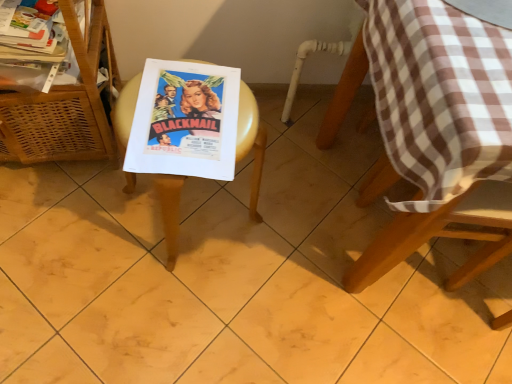
This screenshot has height=384, width=512. Describe the element at coordinates (185, 121) in the screenshot. I see `matte paper poster at center` at that location.

The width and height of the screenshot is (512, 384). I want to click on matte paper poster at center, so tap(185, 121).

This screenshot has width=512, height=384. What do you see at coordinates (29, 67) in the screenshot?
I see `white glossy magazine at upper left` at bounding box center [29, 67].

In order to face wooden picnic table at center, should I rotate leftwards or rightwards?

It's best to rotate left around 9.105 degrees.

Locate an element on the screen. The image size is (512, 384). matte paper poster at center is located at coordinates click(x=185, y=121).

How many degrees apart are the facing directions of woven wood basket at left and wooden picnic table at center?

woven wood basket at left and wooden picnic table at center are facing 33.6 degrees away from each other.

From the image's perspective, between woven wood basket at left and wooden picnic table at center, who is located below?

wooden picnic table at center is shown below in the image.

Measure the distance between woven wood basket at left and wooden picnic table at center.

woven wood basket at left is 7.87 inches from wooden picnic table at center.

Which of these two, woven wood basket at left or wooden picnic table at center, is bigger?

Bigger between the two is woven wood basket at left.

From a real-world perspective, who is located lower, white glossy magazine at upper left or woven wood basket at left?

woven wood basket at left.

This screenshot has height=384, width=512. I want to click on furniture below the white glossy magazine at upper left (from a real-world perspective), so [x=65, y=103].

Is white glossy magazine at upper left shorter than woven wood basket at left?

Correct, white glossy magazine at upper left is not as tall as woven wood basket at left.

What's the angular difference between white glossy magazine at upper left and wooden picnic table at center's facing directions?

The angle between the facing direction of white glossy magazine at upper left and the facing direction of wooden picnic table at center is 36.3 degrees.

Does white glossy magazine at upper left have a smaller size compared to wooden picnic table at center?

Correct, white glossy magazine at upper left occupies less space than wooden picnic table at center.

In the image, is white glossy magazine at upper left positioned in front of or behind wooden picnic table at center?

In the image, white glossy magazine at upper left appears behind wooden picnic table at center.

In the scene shown: Does white glossy magazine at upper left turn towards wooden picnic table at center?

No, white glossy magazine at upper left is not turned towards wooden picnic table at center.

In the scene shown: Can you tell me how much wooden picnic table at center and matte paper poster at center differ in facing direction?

40.4 degrees separate the facing orientations of wooden picnic table at center and matte paper poster at center.

Is wooden picnic table at center bigger than matte paper poster at center?

Yes.

Is matte paper poster at center completely or partially inside wooden picnic table at center?

Yes, matte paper poster at center is a part of wooden picnic table at center.

Is wooden picnic table at center aimed at matte paper poster at center?

No, wooden picnic table at center does not turn towards matte paper poster at center.

Based on the photo, from a real-world perspective, is woven wood basket at left physically above white glossy magazine at upper left?

Actually, woven wood basket at left is physically below white glossy magazine at upper left in the real world.

What's the angular difference between woven wood basket at left and white glossy magazine at upper left's facing directions?

woven wood basket at left and white glossy magazine at upper left are facing 2.67 degrees away from each other.

Is woven wood basket at left at the left side of white glossy magazine at upper left?

Correct, you'll find woven wood basket at left to the left of white glossy magazine at upper left.

The width and height of the screenshot is (512, 384). In order to click on magazine that is above the woven wood basket at left (from the image's perspective) in this screenshot , I will do `click(29, 67)`.

How different are the orientations of white glossy magazine at upper left and brown checkered tablecloth at upper right in degrees?

There is a 0.585-degree angle between the facing directions of white glossy magazine at upper left and brown checkered tablecloth at upper right.

Is white glossy magazine at upper left wider than brown checkered tablecloth at upper right?

No.

Is white glossy magazine at upper left far from brown checkered tablecloth at upper right?

Actually, white glossy magazine at upper left and brown checkered tablecloth at upper right are a little close together.

From the image's perspective, which is above, white glossy magazine at upper left or brown checkered tablecloth at upper right?

From the image's view, brown checkered tablecloth at upper right is above.

This screenshot has height=384, width=512. Identify the location of magazine behind the brown checkered tablecloth at upper right. (29, 67).

In terms of width, does brown checkered tablecloth at upper right look wider or thinner when compared to white glossy magazine at upper left?

In the image, brown checkered tablecloth at upper right appears to be wider than white glossy magazine at upper left.

Considering the relative positions of brown checkered tablecloth at upper right and white glossy magazine at upper left in the image provided, is brown checkered tablecloth at upper right behind white glossy magazine at upper left?

No, brown checkered tablecloth at upper right is closer to the viewer.

Is brown checkered tablecloth at upper right directly adjacent to white glossy magazine at upper left?

No.

You are a GUI agent. You are given a task and a screenshot of the screen. Output one action in this format:
    pyautogui.click(x=<x>, y=<y>)
    Task: Click on the picnic table on the right side of woven wood basket at left
    The height and width of the screenshot is (384, 512).
    Given the screenshot: What is the action you would take?
    pyautogui.click(x=251, y=143)

This screenshot has width=512, height=384. Find the location of `furniture in front of the white glossy magazine at upper left`. furniture in front of the white glossy magazine at upper left is located at coordinates 65,103.

From the image, which object appears to be farther from wooden picnic table at center, matte paper poster at center or white glossy magazine at upper left?

white glossy magazine at upper left lies further to wooden picnic table at center than the other object.

From the image, which object appears to be nearer to woven wood basket at left, matte paper poster at center or white glossy magazine at upper left?

Based on the image, white glossy magazine at upper left appears to be nearer to woven wood basket at left.

In the scene shown: Looking at the image, which one is located closer to brown checkered tablecloth at upper right, wooden picnic table at center or matte paper poster at center?

Among the two, matte paper poster at center is located nearer to brown checkered tablecloth at upper right.

Considering their positions, is wooden picnic table at center positioned further to woven wood basket at left than white glossy magazine at upper left?

The object further to woven wood basket at left is wooden picnic table at center.

Estimate the real-world distances between objects in this image. Which object is closer to matte paper poster at center, brown checkered tablecloth at upper right or wooden picnic table at center?

wooden picnic table at center lies closer to matte paper poster at center than the other object.

Considering their positions, is wooden picnic table at center positioned further to woven wood basket at left than brown checkered tablecloth at upper right?

Based on the image, brown checkered tablecloth at upper right appears to be further to woven wood basket at left.

From the image, which object appears to be nearer to brown checkered tablecloth at upper right, matte paper poster at center or wooden picnic table at center?

matte paper poster at center is closer to brown checkered tablecloth at upper right.

Estimate the real-world distances between objects in this image. Which object is closer to white glossy magazine at upper left, woven wood basket at left or matte paper poster at center?

Among the two, woven wood basket at left is located nearer to white glossy magazine at upper left.

Locate an element on the screen. comic book located between wooden picnic table at center and brown checkered tablecloth at upper right in the left-right direction is located at coordinates (185, 121).

I want to click on picnic table between white glossy magazine at upper left and matte paper poster at center from left to right, so click(251, 143).

The width and height of the screenshot is (512, 384). What are the coordinates of `comic book located between white glossy magazine at upper left and brown checkered tablecloth at upper right in the left-right direction` in the screenshot? It's located at (185, 121).

Find the location of a particular element. magazine between woven wood basket at left and brown checkered tablecloth at upper right from left to right is located at coordinates (29, 67).